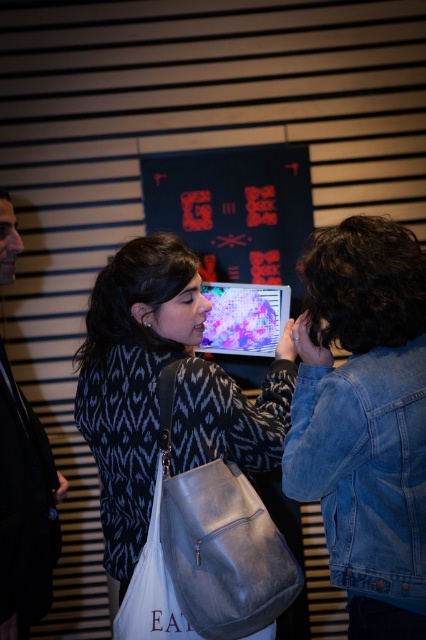
You are standing at the center of the room and want to move towards the denim jacket at lower right. What direction should you move in to reach it?

Since the denim jacket at lower right is located at point 0.728 on the x axis and 0.857 on the y axis, you should move towards the lower right direction to reach it.